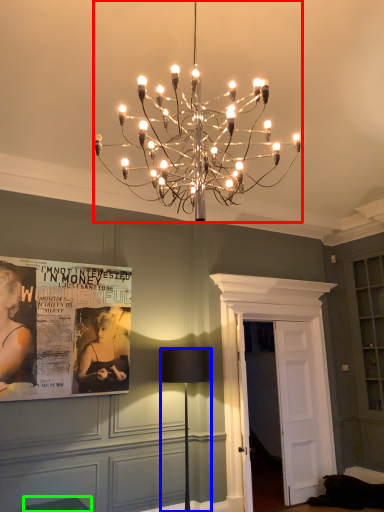
Question: Estimate the real-world distances between objects in this image. Which object is farther from lamp (highlighted by a red box), lamp (highlighted by a blue box) or furniture (highlighted by a green box)?

Choices:
 (A) lamp
 (B) furniture

Answer: (B)